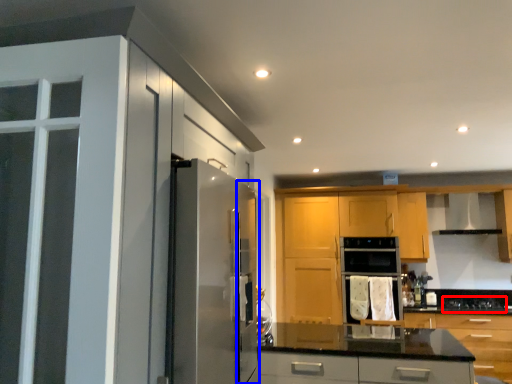
Question: Among these objects, which one is farthest to the camera, gas stove (highlighted by a red box) or screen door (highlighted by a blue box)?

Choices:
 (A) gas stove
 (B) screen door

Answer: (A)